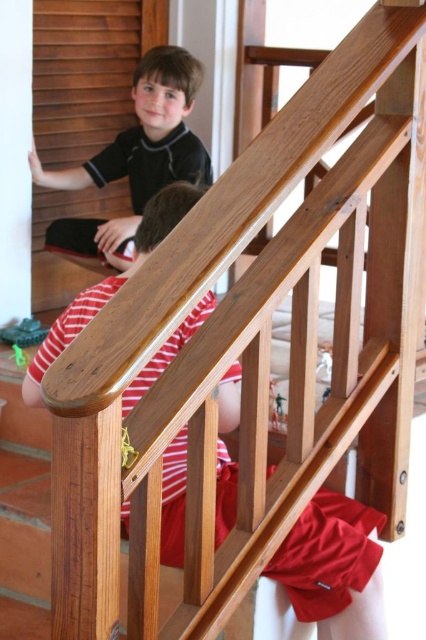
Is striped cotton shirt at center thinner than matte black shirt at upper left?

Indeed, striped cotton shirt at center has a lesser width compared to matte black shirt at upper left.

At what (x,y) coordinates should I click in order to perform the action: click on striped cotton shirt at center. Please return your answer as a coordinate pair (x, y). Looking at the image, I should click on (333, 566).